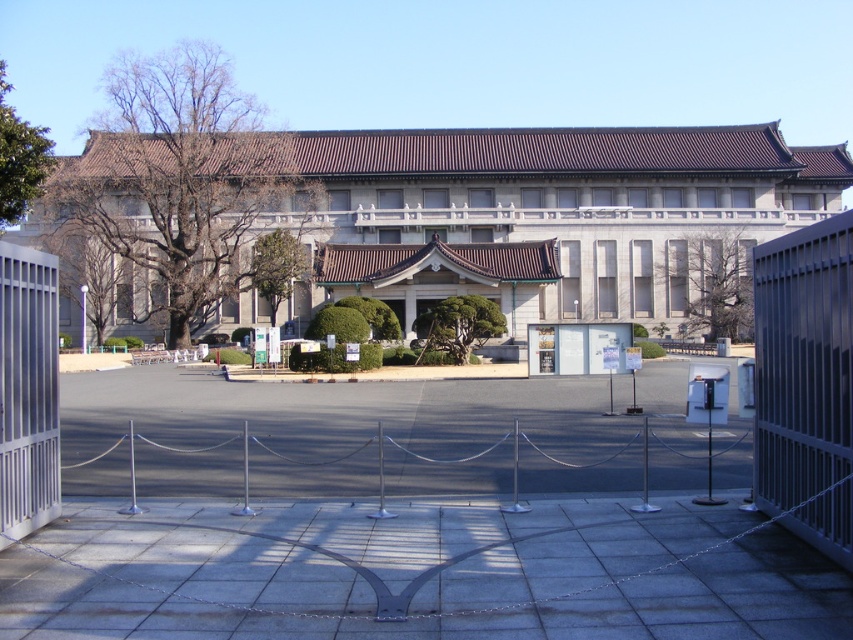
Question: Among these objects, which one is nearest to the camera?

Choices:
 (A) stone gray building at center
 (B) metallic gate at left
 (C) silver metallic fence at center
 (D) metallic gray gate at right

Answer: (D)

Question: Is stone gray building at center wider than metallic gate at left?

Choices:
 (A) no
 (B) yes

Answer: (B)

Question: Considering the real-world distances, which object is farthest from the metallic gray gate at right?

Choices:
 (A) metallic gate at left
 (B) silver metallic fence at center
 (C) stone gray building at center

Answer: (C)

Question: Does metallic gate at left have a larger size compared to silver metallic fence at center?

Choices:
 (A) yes
 (B) no

Answer: (B)

Question: Where is stone gray building at center located in relation to metallic gate at left in the image?

Choices:
 (A) left
 (B) right

Answer: (B)

Question: Which object is positioned closest to the silver metallic fence at center?

Choices:
 (A) stone gray building at center
 (B) metallic gate at left

Answer: (B)